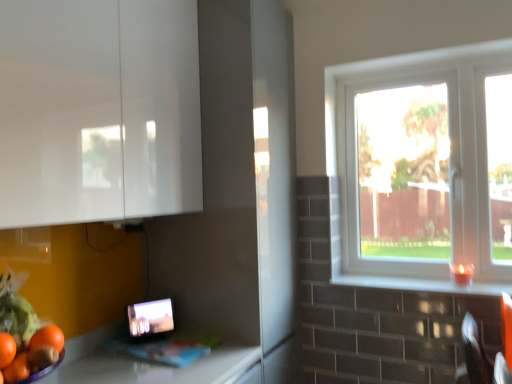
Question: Is white glossy window sill at right facing away from white plastic window at right?

Choices:
 (A) yes
 (B) no

Answer: (A)

Question: Can you confirm if white glossy window sill at right is positioned to the right of white plastic window at right?

Choices:
 (A) no
 (B) yes

Answer: (A)

Question: Is white plastic window at right inside white glossy window sill at right?

Choices:
 (A) no
 (B) yes

Answer: (A)

Question: Does white glossy window sill at right appear on the left side of white plastic window at right?

Choices:
 (A) yes
 (B) no

Answer: (A)

Question: Is white glossy window sill at right not close to white plastic window at right?

Choices:
 (A) no
 (B) yes

Answer: (A)

Question: Considering the positions of point (136, 339) and point (333, 281), is point (136, 339) closer or farther from the camera than point (333, 281)?

Choices:
 (A) closer
 (B) farther

Answer: (A)

Question: Is matte black tablet at lower left wider or thinner than white glossy window sill at right?

Choices:
 (A) wide
 (B) thin

Answer: (B)

Question: Is matte black tablet at lower left bigger or smaller than white glossy window sill at right?

Choices:
 (A) small
 (B) big

Answer: (B)

Question: From a real-world perspective, is matte black tablet at lower left positioned above or below white glossy window sill at right?

Choices:
 (A) below
 (B) above

Answer: (A)

Question: From the image's perspective, relative to matte black tablet at lower left, is white glossy window sill at right above or below?

Choices:
 (A) below
 (B) above

Answer: (B)

Question: Considering the positions of white glossy window sill at right and matte black tablet at lower left in the image, is white glossy window sill at right taller or shorter than matte black tablet at lower left?

Choices:
 (A) tall
 (B) short

Answer: (B)

Question: Do you think white glossy window sill at right is within matte black tablet at lower left, or outside of it?

Choices:
 (A) outside
 (B) inside

Answer: (A)

Question: Is white glossy window sill at right bigger or smaller than matte black tablet at lower left?

Choices:
 (A) big
 (B) small

Answer: (B)

Question: In the image, is white glossy window sill at right on the left side or the right side of white plastic window at right?

Choices:
 (A) left
 (B) right

Answer: (A)

Question: Is white glossy window sill at right inside or outside of white plastic window at right?

Choices:
 (A) outside
 (B) inside

Answer: (A)